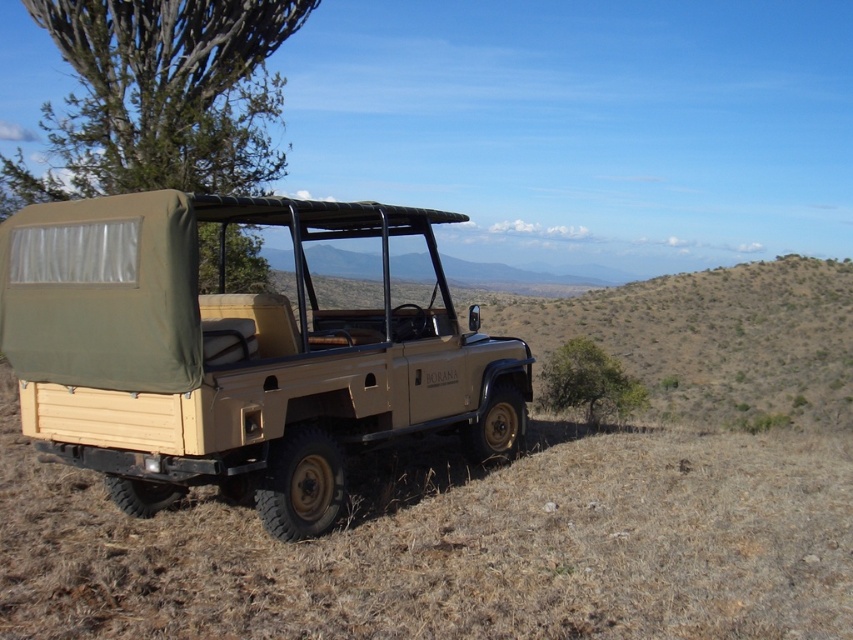
You are standing in front of the safari vehicle and want to locate two specific points marked on the terrain. The first point is at coordinates point (82,192) and the second is at point (569,404). Which point is closer to you?

Point (82,192) is closer to you because it is further to the viewer than point (569,404).

You are a passenger in the safari vehicle and want to point out an animal to the driver. The driver asks you where the animal is located relative to the jeep. You see the animal at point (234, 355). How would you describe the animal location?

The animal is on the matte khaki jeep at center.